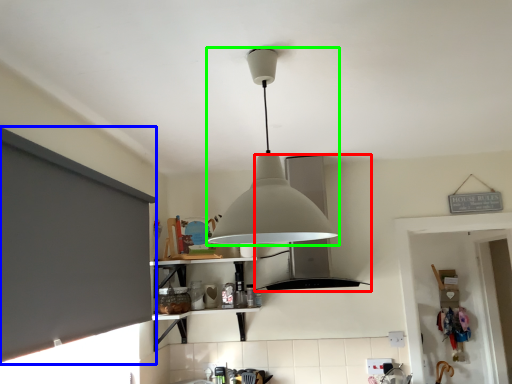
Question: Based on their relative distances, which object is nearer to vent (highlighted by a red box)? Choose from window screen (highlighted by a blue box) and lamp (highlighted by a green box).

Choices:
 (A) window screen
 (B) lamp

Answer: (A)